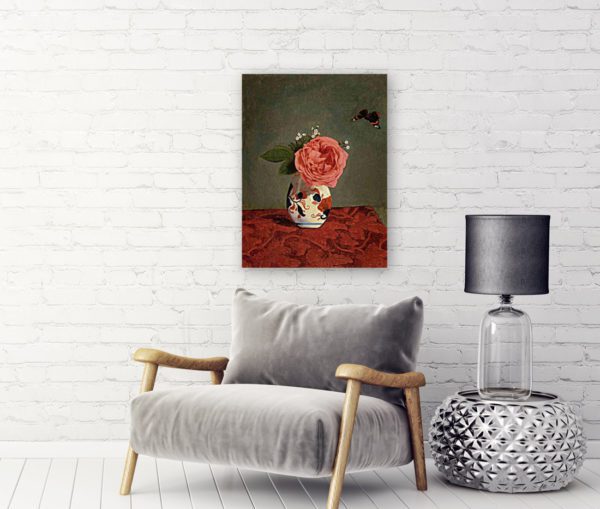
At what (x,y) coordinates should I click in order to perform the action: click on black lampshade. Please return your answer as a coordinate pair (x, y). Looking at the image, I should click on (523, 241).